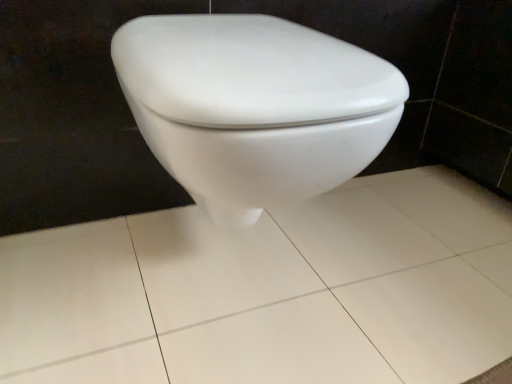
Image resolution: width=512 pixels, height=384 pixels. What are the coordinates of `white glossy toilet at center` in the screenshot? It's located at (270, 291).

What do you see at coordinates (270, 291) in the screenshot?
I see `white glossy toilet at center` at bounding box center [270, 291].

Identify the location of white glossy toilet at center. The height and width of the screenshot is (384, 512). (270, 291).